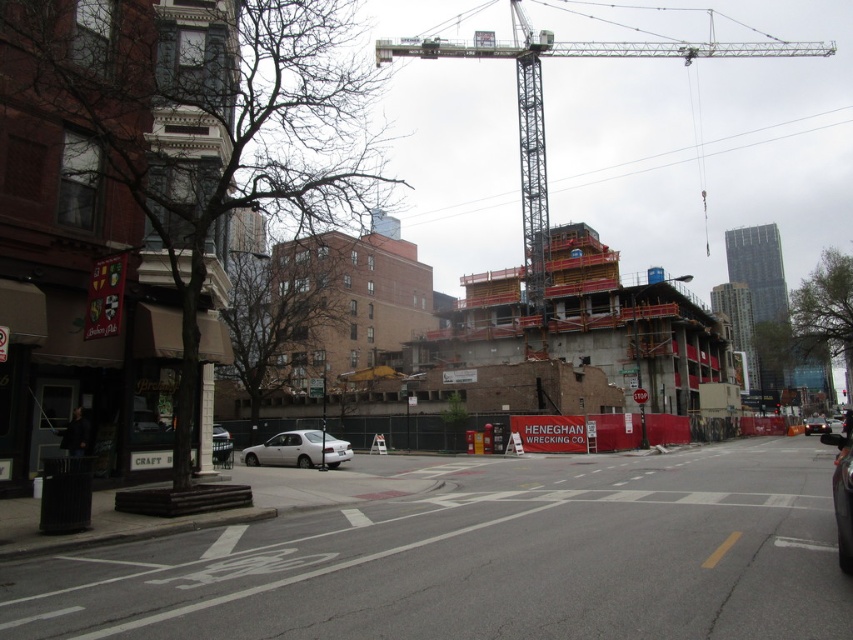
Question: Which of these objects is positioned closest to the smooth asphalt road at center?

Choices:
 (A) shiny black sedan at center
 (B) silver metallic sedan at center
 (C) white matte car at center

Answer: (C)

Question: Which point is closer to the camera?

Choices:
 (A) shiny black sedan at center
 (B) silver metallic sedan at center

Answer: (B)

Question: Is silver metallic sedan at center smaller than white matte car at center?

Choices:
 (A) no
 (B) yes

Answer: (B)

Question: In this image, where is smooth asphalt road at center located relative to silver metallic sedan at center?

Choices:
 (A) right
 (B) left

Answer: (A)

Question: Among these points, which one is nearest to the camera?

Choices:
 (A) (805, 420)
 (B) (259, 573)

Answer: (B)

Question: Can you confirm if metallic gray crane at upper center is thinner than silver metallic sedan at center?

Choices:
 (A) yes
 (B) no

Answer: (B)